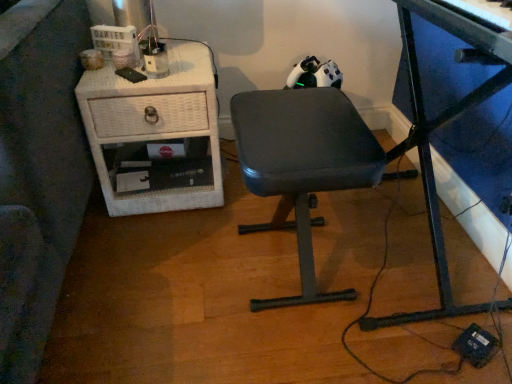
Question: Is white wicker nightstand at left positioned before dark gray fabric chair at center?

Choices:
 (A) no
 (B) yes

Answer: (A)

Question: Considering the relative sizes of white wicker nightstand at left and dark gray fabric chair at center in the image provided, is white wicker nightstand at left shorter than dark gray fabric chair at center?

Choices:
 (A) no
 (B) yes

Answer: (B)

Question: Is white wicker nightstand at left taller than dark gray fabric chair at center?

Choices:
 (A) no
 (B) yes

Answer: (A)

Question: From a real-world perspective, is white wicker nightstand at left under dark gray fabric chair at center?

Choices:
 (A) no
 (B) yes

Answer: (B)

Question: Is white wicker nightstand at left oriented towards dark gray fabric chair at center?

Choices:
 (A) yes
 (B) no

Answer: (B)

Question: Can dark gray fabric chair at center be found inside white wicker nightstand at left?

Choices:
 (A) no
 (B) yes

Answer: (A)

Question: From the image's perspective, does dark gray fabric chair at center appear higher than white wicker nightstand at left?

Choices:
 (A) no
 (B) yes

Answer: (A)

Question: Is dark gray fabric chair at center positioned behind white wicker nightstand at left?

Choices:
 (A) no
 (B) yes

Answer: (A)

Question: Is dark gray fabric chair at center not near white wicker nightstand at left?

Choices:
 (A) yes
 (B) no

Answer: (B)

Question: Is dark gray fabric chair at center outside white wicker nightstand at left?

Choices:
 (A) no
 (B) yes

Answer: (B)

Question: Would you say dark gray fabric chair at center contains white wicker nightstand at left?

Choices:
 (A) yes
 (B) no

Answer: (B)

Question: Could you tell me if dark gray fabric chair at center is facing white wicker nightstand at left?

Choices:
 (A) no
 (B) yes

Answer: (A)

Question: Considering the relative sizes of metallic blue desk at center and white wicker nightstand at left in the image provided, is metallic blue desk at center bigger than white wicker nightstand at left?

Choices:
 (A) no
 (B) yes

Answer: (B)